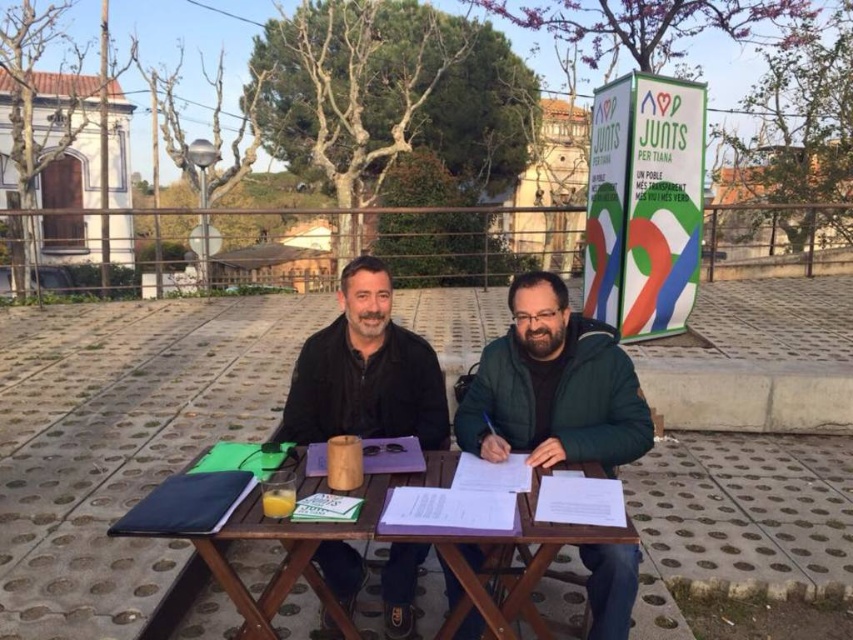
Who is shorter, wooden picnic table at center or black matte jacket at center?

Standing shorter between the two is wooden picnic table at center.

Between point (183, 506) and point (363, 353), which one is positioned behind?

The point (363, 353) is behind.

This screenshot has width=853, height=640. I want to click on wooden picnic table at center, so point(354,538).

Image resolution: width=853 pixels, height=640 pixels. I want to click on wooden picnic table at center, so click(x=354, y=538).

Between green matte jacket at center and black matte jacket at center, which one appears on the right side from the viewer's perspective?

From the viewer's perspective, green matte jacket at center appears more on the right side.

Between green matte jacket at center and black matte jacket at center, which one is positioned higher?

black matte jacket at center is above.

Which is in front, point (506, 355) or point (427, 371)?

Point (506, 355) is in front.

Locate an element on the screen. green matte jacket at center is located at coordinates (553, 387).

Is green matte jacket at center positioned at the back of wooden picnic table at center?

Yes, it is.

Measure the distance between point (590, 589) and camera.

The distance of point (590, 589) from camera is 1.98 meters.

At what (x,y) coordinates should I click in order to perform the action: click on green matte jacket at center. Please return your answer as a coordinate pair (x, y). This screenshot has height=640, width=853. Looking at the image, I should click on pyautogui.click(x=553, y=387).